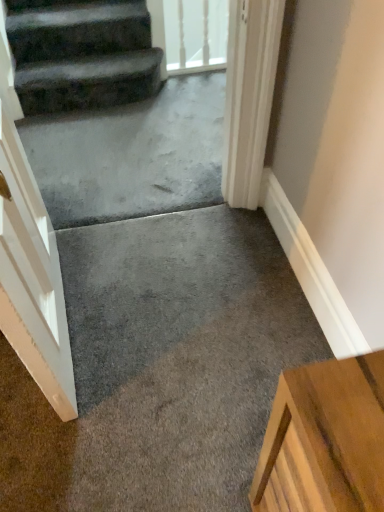
Question: Considering the positions of dark gray carpeted stairs at upper left and gray concrete at center in the image, is dark gray carpeted stairs at upper left taller or shorter than gray concrete at center?

Choices:
 (A) tall
 (B) short

Answer: (A)

Question: Considering the relative positions of dark gray carpeted stairs at upper left and gray concrete at center in the image provided, is dark gray carpeted stairs at upper left to the left or to the right of gray concrete at center?

Choices:
 (A) right
 (B) left

Answer: (B)

Question: Which is nearer to the dark gray carpeted stairs at upper left?

Choices:
 (A) transparent glass door at upper center
 (B) gray concrete at center

Answer: (B)

Question: Which object is the closest to the transparent glass door at upper center?

Choices:
 (A) gray concrete at center
 (B) dark gray carpeted stairs at upper left

Answer: (B)